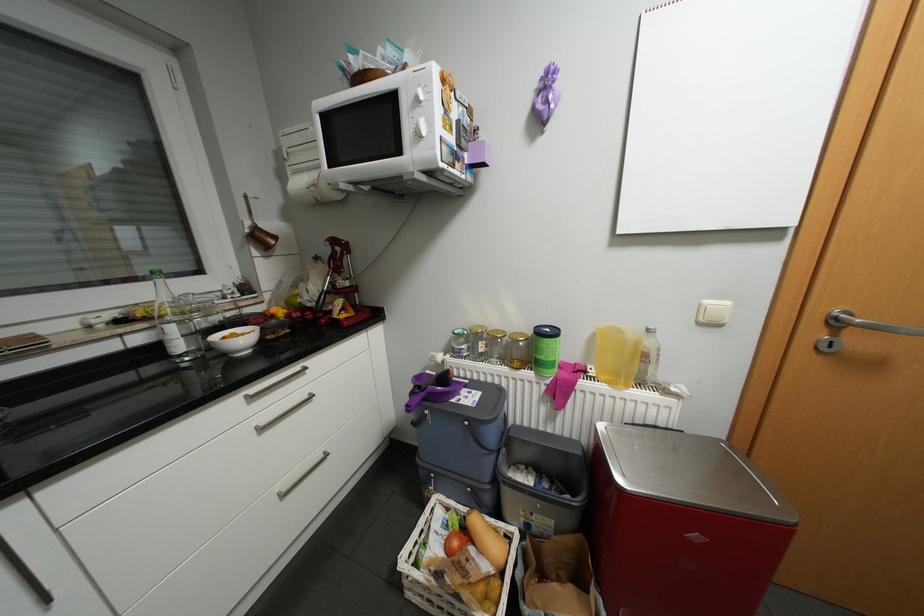
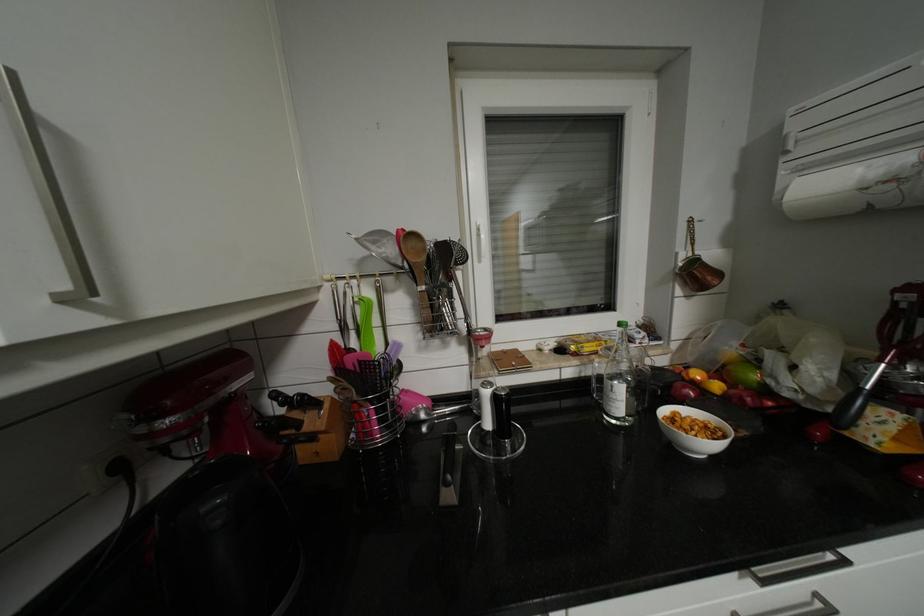
Find the pixel in the second image that matches (176,330) in the first image.

(623, 387)